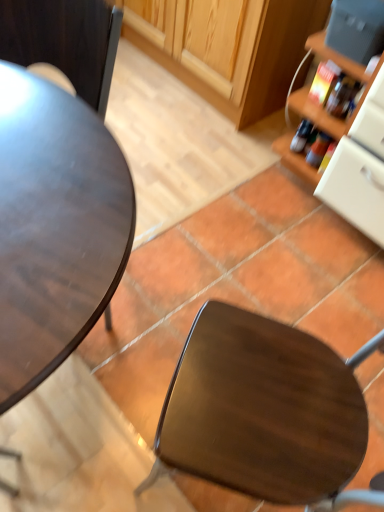
This screenshot has height=512, width=384. I want to click on shiny brown chair at center, so click(263, 409).

Image resolution: width=384 pixels, height=512 pixels. Find the location of `matte dark wood desk at left`. matte dark wood desk at left is located at coordinates (55, 227).

Can you confirm if shiny brown chair at center is shorter than matte gray toaster at upper right?

Incorrect, the height of shiny brown chair at center does not fall short of that of matte gray toaster at upper right.

Does shiny brown chair at center turn towards matte gray toaster at upper right?

No, shiny brown chair at center is not oriented towards matte gray toaster at upper right.

How far apart are shiny brown chair at center and matte gray toaster at upper right?

shiny brown chair at center is 3.65 feet from matte gray toaster at upper right.

From the picture: Which object is closer to the camera taking this photo, shiny brown chair at center or matte dark wood desk at left?

shiny brown chair at center.

Choose the correct answer: Is shiny brown chair at center inside matte dark wood desk at left or outside it?

shiny brown chair at center is spatially situated outside matte dark wood desk at left.

This screenshot has height=512, width=384. I want to click on chair below the matte dark wood desk at left (from a real-world perspective), so click(263, 409).

How many degrees apart are the facing directions of shiny brown chair at center and matte dark wood desk at left?

86.6 degrees.

Where is `cabinetry lying above the shiny brown chair at center (from the image's perspective)`? This screenshot has width=384, height=512. cabinetry lying above the shiny brown chair at center (from the image's perspective) is located at coordinates (227, 47).

Can you confirm if shiny brown chair at center is taller than wooden cabinet at upper center?

Indeed, shiny brown chair at center has a greater height compared to wooden cabinet at upper center.

Is shiny brown chair at center not inside wooden cabinet at upper center?

Yes, shiny brown chair at center is located beyond the bounds of wooden cabinet at upper center.

From a real-world perspective, between matte dark wood desk at left and matte gray toaster at upper right, who is vertically higher?

From a 3D spatial view, matte gray toaster at upper right is above.

Would you consider matte dark wood desk at left to be distant from matte gray toaster at upper right?

Absolutely, matte dark wood desk at left is distant from matte gray toaster at upper right.

Would you say matte dark wood desk at left is outside matte gray toaster at upper right?

matte dark wood desk at left is positioned outside matte gray toaster at upper right.

Locate an element on the screen. The height and width of the screenshot is (512, 384). appliance positioned vertically above the matte dark wood desk at left (from a real-world perspective) is located at coordinates (356, 29).

Does wooden cabinet at upper center turn towards matte dark wood desk at left?

Yes, wooden cabinet at upper center is turned towards matte dark wood desk at left.

Consider the image. Does wooden cabinet at upper center appear on the left side of matte dark wood desk at left?

No.

In the scene shown: Considering the sizes of objects wooden cabinet at upper center and matte dark wood desk at left in the image provided, who is wider, wooden cabinet at upper center or matte dark wood desk at left?

Wider between the two is wooden cabinet at upper center.

Can matte dark wood desk at left be found inside wooden cabinet at upper center?

No, matte dark wood desk at left is located outside of wooden cabinet at upper center.

Is shiny brown chair at center surrounded by matte gray toaster at upper right?

No, shiny brown chair at center is not inside matte gray toaster at upper right.

From a real-world perspective, is matte gray toaster at upper right below shiny brown chair at center?

Incorrect, from a real-world perspective, matte gray toaster at upper right is higher than shiny brown chair at center.

Based on their positions, is matte gray toaster at upper right located to the left or right of shiny brown chair at center?

Clearly, matte gray toaster at upper right is on the right of shiny brown chair at center in the image.

Which object is wider, matte gray toaster at upper right or shiny brown chair at center?

Wider between the two is shiny brown chair at center.

Based on their sizes in the image, would you say shiny brown chair at center is bigger or smaller than translucent plastic bottle at right?

Clearly, shiny brown chair at center is larger in size than translucent plastic bottle at right.

Which is closer, (301, 468) or (319, 139)?

Point (301, 468).

Is translucent plastic bottle at right surrounded by shiny brown chair at center?

No.

I want to click on chair in front of the matte gray toaster at upper right, so click(263, 409).

Where is `desk behind the shiny brown chair at center`? The image size is (384, 512). desk behind the shiny brown chair at center is located at coordinates (55, 227).

Which object lies nearer to the anchor point matte gray toaster at upper right, matte dark wood desk at left or wooden cabinet at upper center?

wooden cabinet at upper center is closer to matte gray toaster at upper right.

Looking at the image, which one is located further to translucent plastic bottle at right, matte gray toaster at upper right or wooden cabinet at upper center?

Among the two, wooden cabinet at upper center is located further to translucent plastic bottle at right.

Based on their spatial positions, is translucent plastic bottle at right or wooden cabinet at upper center closer to matte dark wood desk at left?

translucent plastic bottle at right is positioned closer to the anchor matte dark wood desk at left.

From the image, which object appears to be nearer to wooden cabinet at upper center, shiny brown chair at center or translucent plastic bottle at right?

translucent plastic bottle at right lies closer to wooden cabinet at upper center than the other object.

Estimate the real-world distances between objects in this image. Which object is further from matte gray toaster at upper right, wooden cabinet at upper center or translucent plastic bottle at right?

Based on the image, wooden cabinet at upper center appears to be further to matte gray toaster at upper right.

Considering their positions, is matte gray toaster at upper right positioned closer to translucent plastic bottle at right than matte dark wood desk at left?

matte gray toaster at upper right is closer to translucent plastic bottle at right.

Estimate the real-world distances between objects in this image. Which object is further from matte dark wood desk at left, matte gray toaster at upper right or translucent plastic bottle at right?

The object further to matte dark wood desk at left is translucent plastic bottle at right.

Estimate the real-world distances between objects in this image. Which object is closer to wooden cabinet at upper center, matte dark wood desk at left or translucent plastic bottle at right?

The object closer to wooden cabinet at upper center is translucent plastic bottle at right.

You are a GUI agent. You are given a task and a screenshot of the screen. Output one action in this format:
    pyautogui.click(x=<x>, y=<y>)
    Task: Click on the desk between shiny brown chair at center and translucent plastic bottle at right in the front-back direction
    
    Given the screenshot: What is the action you would take?
    pyautogui.click(x=55, y=227)

This screenshot has height=512, width=384. I want to click on appliance between wooden cabinet at upper center and shiny brown chair at center from top to bottom, so click(356, 29).

You are a GUI agent. You are given a task and a screenshot of the screen. Output one action in this format:
    pyautogui.click(x=<x>, y=<y>)
    Task: Click on the appliance positioned between shiny brown chair at center and translucent plastic bottle at right from near to far
    The width and height of the screenshot is (384, 512).
    Given the screenshot: What is the action you would take?
    pyautogui.click(x=356, y=29)

Where is `cabinetry between matte dark wood desk at left and translucent plastic bottle at right along the z-axis`? cabinetry between matte dark wood desk at left and translucent plastic bottle at right along the z-axis is located at coordinates (227, 47).